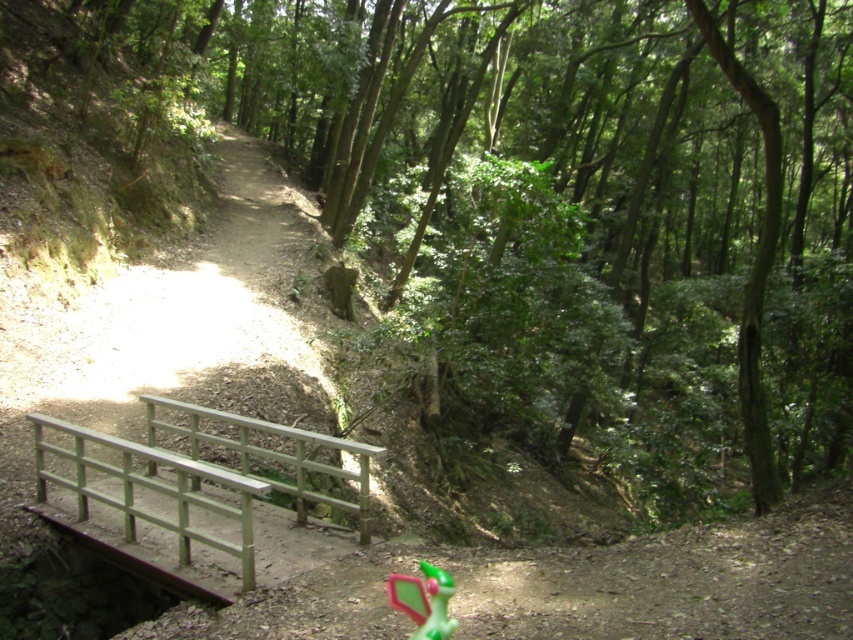
Question: Where is wooden bridge at lower left located in relation to green painted wood rail at lower center in the image?

Choices:
 (A) below
 (B) above

Answer: (B)

Question: Which point is closer to the camera?

Choices:
 (A) (39, 422)
 (B) (425, 573)

Answer: (B)

Question: Considering the relative positions of green painted wood rail at lower center and green matte toy at lower center in the image provided, where is green painted wood rail at lower center located with respect to green matte toy at lower center?

Choices:
 (A) right
 (B) left

Answer: (B)

Question: Is green painted wood rail at lower center further to the viewer compared to green matte toy at lower center?

Choices:
 (A) no
 (B) yes

Answer: (B)

Question: Which of these objects is positioned closest to the wooden bridge at lower left?

Choices:
 (A) green painted wood rail at lower center
 (B) green matte toy at lower center

Answer: (A)

Question: Which of the following is the farthest from the observer?

Choices:
 (A) green painted wood rail at lower center
 (B) green matte toy at lower center

Answer: (A)